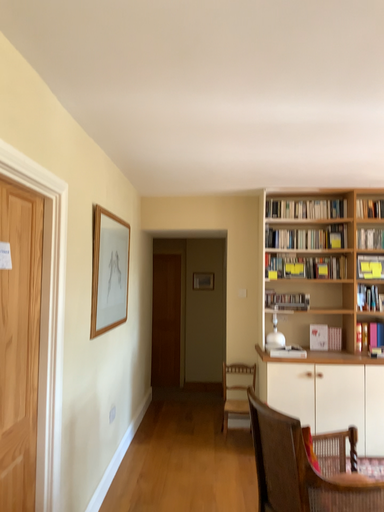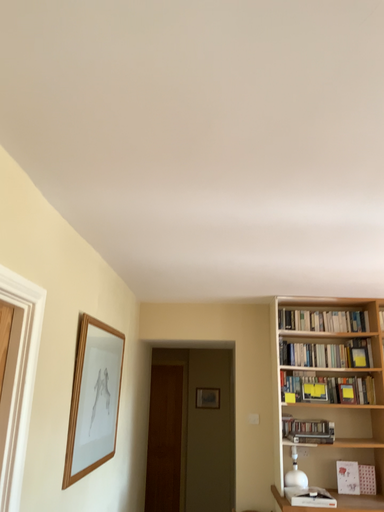
Question: Which way did the camera rotate in the video?

Choices:
 (A) rotated downward
 (B) rotated upward

Answer: (B)